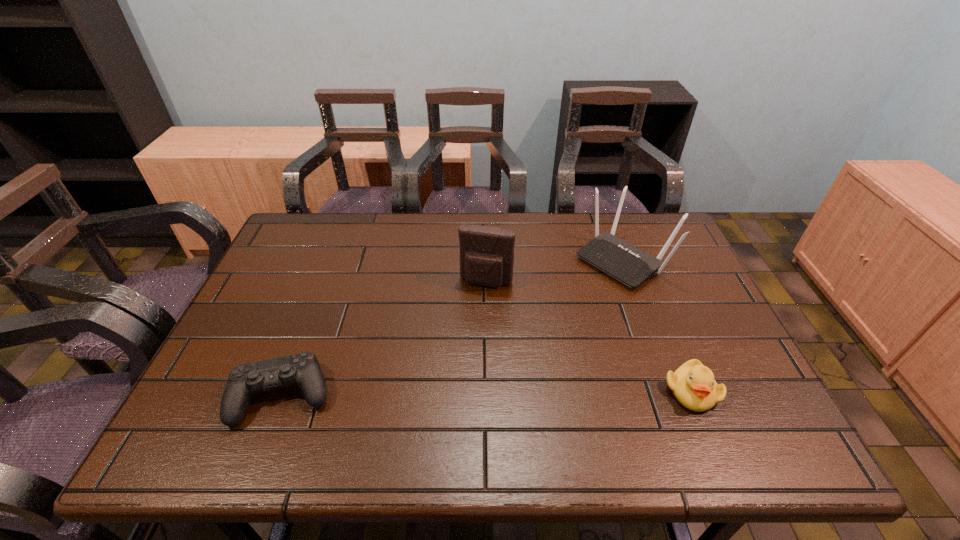
The image size is (960, 540). Find the location of `free spot on the desktop that is between the leftmost object and the duckling and is positioned on the front-facing side of the router`. free spot on the desktop that is between the leftmost object and the duckling and is positioned on the front-facing side of the router is located at coordinates (440, 393).

I want to click on free space on the desktop that is between the leftmost object and the duckling and is positioned with an open flap on the pouch, so click(x=455, y=393).